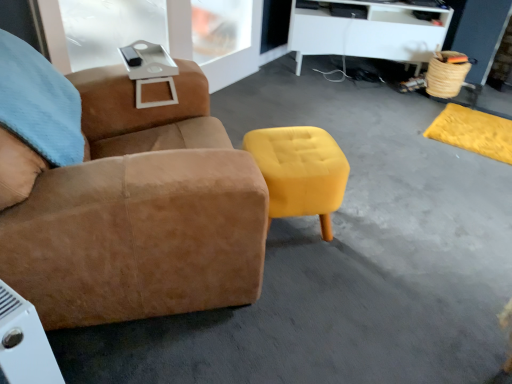
Question: Is white matte desk at upper center at the back of suede brown chair at center?

Choices:
 (A) no
 (B) yes

Answer: (A)

Question: From the image's perspective, is suede brown chair at center located beneath white matte desk at upper center?

Choices:
 (A) no
 (B) yes

Answer: (B)

Question: Is suede brown chair at center at the right side of white matte desk at upper center?

Choices:
 (A) yes
 (B) no

Answer: (B)

Question: Is suede brown chair at center positioned beyond the bounds of white matte desk at upper center?

Choices:
 (A) yes
 (B) no

Answer: (A)

Question: Considering the relative sizes of suede brown chair at center and white matte desk at upper center in the image provided, is suede brown chair at center bigger than white matte desk at upper center?

Choices:
 (A) yes
 (B) no

Answer: (A)

Question: Could you tell me if suede brown chair at center is facing white matte desk at upper center?

Choices:
 (A) yes
 (B) no

Answer: (B)

Question: Considering the relative sizes of yellow suede ottoman at center and suede brown chair at center in the image provided, is yellow suede ottoman at center wider than suede brown chair at center?

Choices:
 (A) no
 (B) yes

Answer: (A)

Question: Is suede brown chair at center inside yellow suede ottoman at center?

Choices:
 (A) yes
 (B) no

Answer: (B)

Question: From the image's perspective, is yellow suede ottoman at center under suede brown chair at center?

Choices:
 (A) no
 (B) yes

Answer: (B)

Question: From a real-world perspective, does yellow suede ottoman at center sit lower than suede brown chair at center?

Choices:
 (A) yes
 (B) no

Answer: (A)

Question: Is yellow suede ottoman at center next to suede brown chair at center?

Choices:
 (A) no
 (B) yes

Answer: (A)

Question: From a real-world perspective, is yellow suede ottoman at center on suede brown chair at center?

Choices:
 (A) no
 (B) yes

Answer: (A)

Question: Is yellow suede ottoman at center smaller than white matte desk at upper center?

Choices:
 (A) yes
 (B) no

Answer: (A)